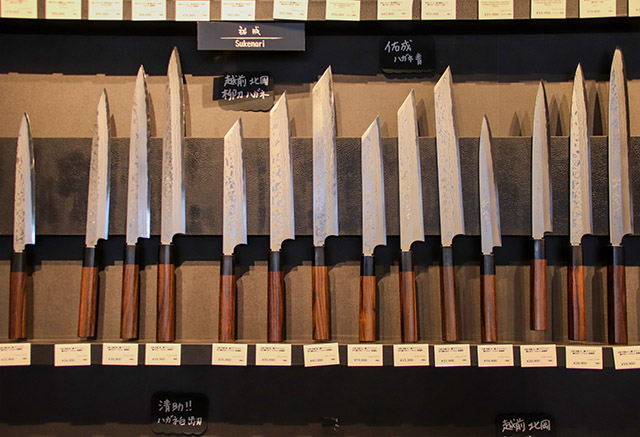
The width and height of the screenshot is (640, 437). Identify the location of wall behind block. (480, 97).